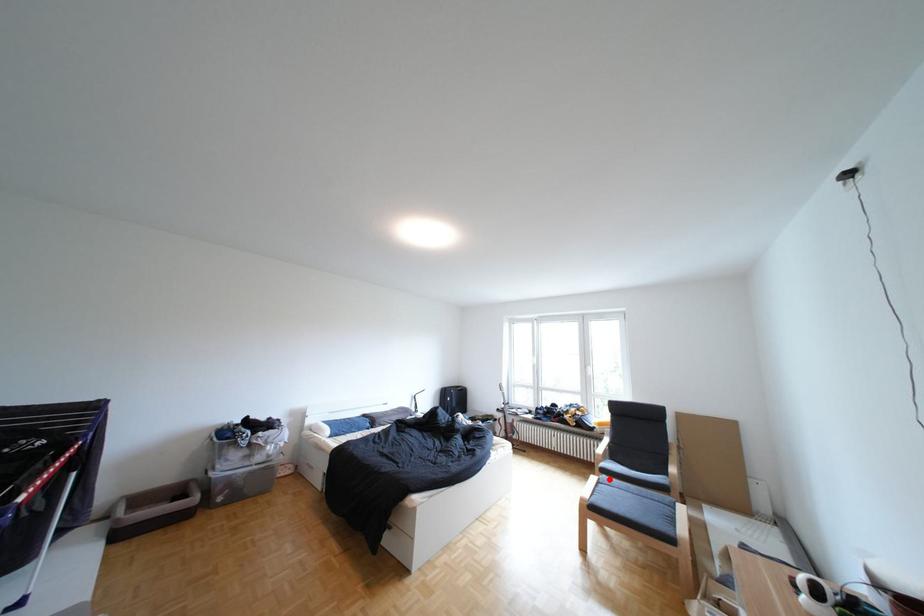
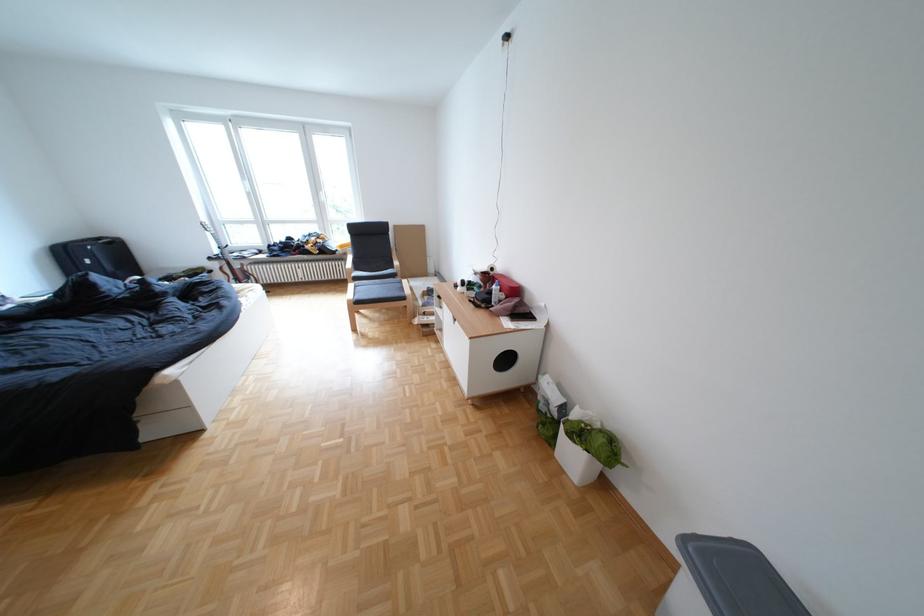
The point at the highlighted location is marked in the first image. Where is the corresponding point in the second image?

(367, 286)